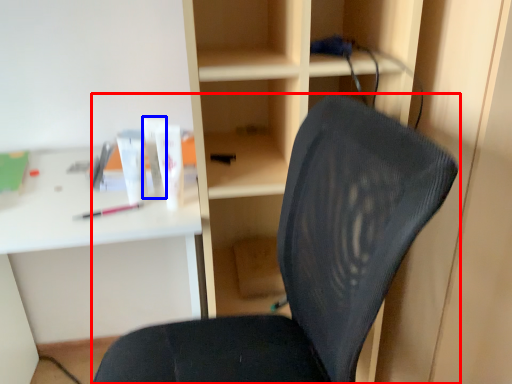
Question: Which point is closer to the camera, chair (highlighted by a red box) or toiletry (highlighted by a blue box)?

Choices:
 (A) chair
 (B) toiletry

Answer: (A)